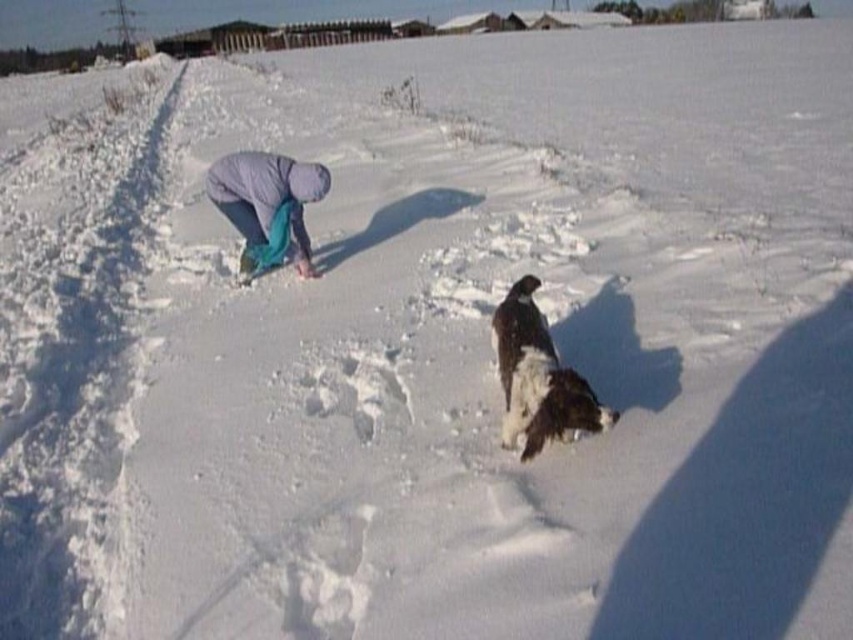
Is the position of white fluffy dog at center less distant than that of light purple fabric at center?

Yes, it is in front of light purple fabric at center.

Does white fluffy dog at center have a larger size compared to light purple fabric at center?

Incorrect, white fluffy dog at center is not larger than light purple fabric at center.

Does point (541, 396) come closer to viewer compared to point (289, 176)?

Yes, point (541, 396) is in front of point (289, 176).

At what (x,y) coordinates should I click in order to perform the action: click on white fluffy dog at center. Please return your answer as a coordinate pair (x, y). The image size is (853, 640). Looking at the image, I should click on (538, 378).